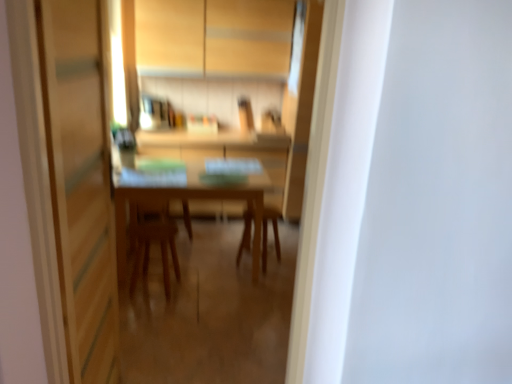
Question: Is wooden chair at center touching wooden chair at center?

Choices:
 (A) yes
 (B) no

Answer: (B)

Question: From a real-world perspective, is wooden chair at center physically above wooden chair at center?

Choices:
 (A) no
 (B) yes

Answer: (A)

Question: Is wooden chair at center at the right side of wooden chair at center?

Choices:
 (A) yes
 (B) no

Answer: (B)

Question: From the image's perspective, is wooden chair at center over wooden chair at center?

Choices:
 (A) no
 (B) yes

Answer: (A)

Question: Can we say wooden chair at center lies outside wooden chair at center?

Choices:
 (A) no
 (B) yes

Answer: (B)

Question: Is wooden chair at center bigger than wooden chair at center?

Choices:
 (A) no
 (B) yes

Answer: (A)

Question: From a real-world perspective, is matte wood cabinetry at upper center located beneath wooden table at center?

Choices:
 (A) yes
 (B) no

Answer: (B)

Question: Is matte wood cabinetry at upper center facing towards wooden table at center?

Choices:
 (A) no
 (B) yes

Answer: (A)

Question: From the image's perspective, is matte wood cabinetry at upper center under wooden table at center?

Choices:
 (A) yes
 (B) no

Answer: (B)

Question: From a real-world perspective, is matte wood cabinetry at upper center located higher than wooden table at center?

Choices:
 (A) yes
 (B) no

Answer: (A)

Question: Is matte wood cabinetry at upper center positioned in front of wooden table at center?

Choices:
 (A) no
 (B) yes

Answer: (A)

Question: Does matte wood cabinetry at upper center appear on the left side of wooden table at center?

Choices:
 (A) yes
 (B) no

Answer: (B)

Question: From a real-world perspective, is wooden table at center below wooden chair at center?

Choices:
 (A) yes
 (B) no

Answer: (B)